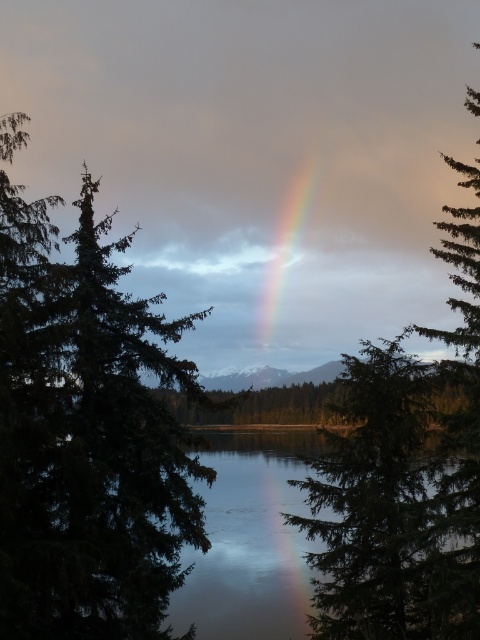
Can you confirm if green matte tree at left is shorter than green matte tree at center?

Yes.

The height and width of the screenshot is (640, 480). I want to click on green matte tree at left, so click(x=85, y=438).

Can you confirm if green matte tree at center is positioned above rainbow at center?

No.

Who is more forward, (469, 561) or (305, 186)?

Point (469, 561) is in front.

Is point (476, 492) closer to camera compared to point (317, 164)?

Yes, point (476, 492) is in front of point (317, 164).

Where is `green matte tree at center`? This screenshot has width=480, height=640. green matte tree at center is located at coordinates (396, 506).

Does point (216, 609) come farther from viewer compared to point (279, 280)?

No, (216, 609) is in front of (279, 280).

Does transparent water at center appear on the left side of rainbow at center?

In fact, transparent water at center is to the right of rainbow at center.

Which is behind, point (223, 524) or point (274, 237)?

The point (274, 237) is behind.

Identify the location of transparent water at center. (250, 540).